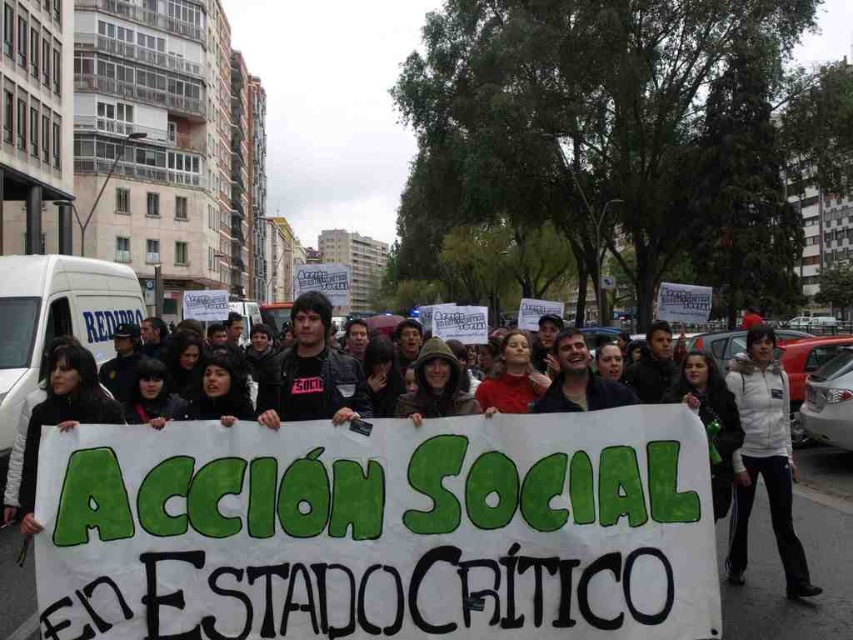
Question: Considering the relative positions of white fleece jacket at lower right and black matte shirt at center in the image provided, where is white fleece jacket at lower right located with respect to black matte shirt at center?

Choices:
 (A) left
 (B) right

Answer: (B)

Question: Where is white fleece jacket at lower right located in relation to black matte shirt at center in the image?

Choices:
 (A) right
 (B) left

Answer: (A)

Question: Does white fleece jacket at lower right have a greater width compared to black matte shirt at center?

Choices:
 (A) no
 (B) yes

Answer: (B)

Question: Which point is closer to the camera?

Choices:
 (A) white fleece jacket at lower right
 (B) black matte shirt at center

Answer: (B)